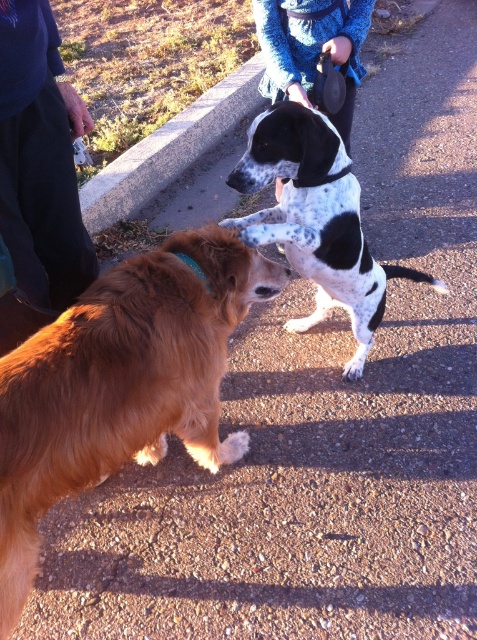
Question: Which is farther from the spotted fur dog at center?

Choices:
 (A) blue knitted sweater at upper center
 (B) blue denim pants at lower left
 (C) golden brown fur at center

Answer: (B)

Question: Is the position of golden brown fur at center more distant than that of blue knitted sweater at upper center?

Choices:
 (A) yes
 (B) no

Answer: (B)

Question: Which point is farther to the camera?

Choices:
 (A) (293, 29)
 (B) (13, 99)
 (C) (354, 262)

Answer: (A)

Question: Can you confirm if golden brown fur at center is positioned to the right of blue denim pants at lower left?

Choices:
 (A) no
 (B) yes

Answer: (B)

Question: Where is golden brown fur at center located in relation to spotted fur dog at center in the image?

Choices:
 (A) below
 (B) above

Answer: (A)

Question: Which point is farther to the camera?

Choices:
 (A) (215, 387)
 (B) (303, 234)
 (C) (301, 72)

Answer: (C)